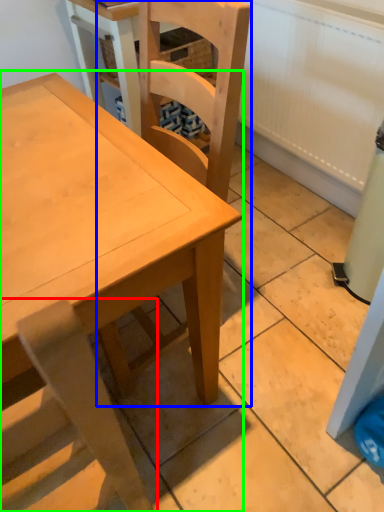
Question: Which object is the closest to the chair (highlighted by a red box)? Choose among these: chair (highlighted by a blue box) or table (highlighted by a green box).

Choices:
 (A) chair
 (B) table

Answer: (B)